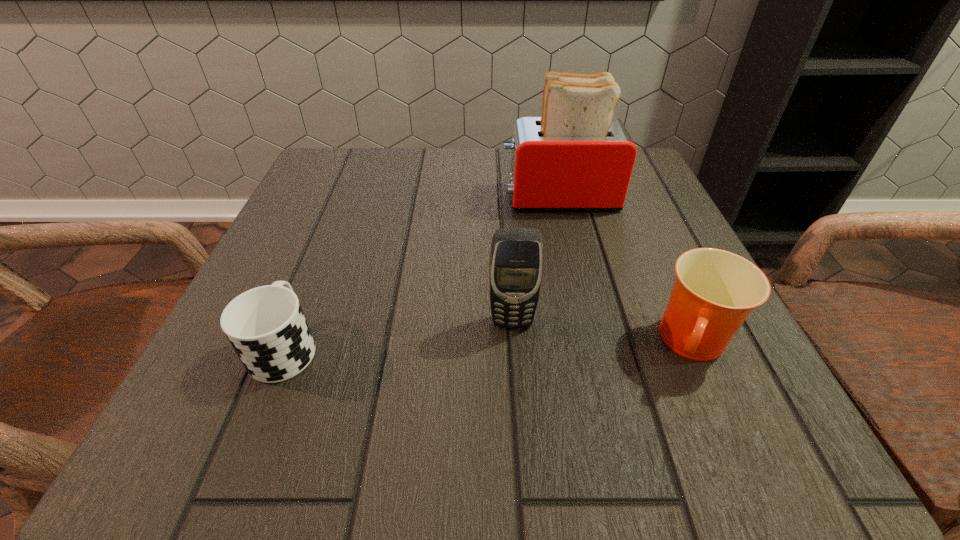
Where is `toaster`? Image resolution: width=960 pixels, height=540 pixels. toaster is located at coordinates (576, 157).

Where is `the tallest object`? the tallest object is located at coordinates (576, 157).

Where is `cellular telephone`? Image resolution: width=960 pixels, height=540 pixels. cellular telephone is located at coordinates (516, 259).

This screenshot has height=540, width=960. In order to click on the right cup in this screenshot , I will do `click(715, 290)`.

Where is `the third tallest object`? The image size is (960, 540). the third tallest object is located at coordinates (715, 290).

Locate an element on the screen. the leftmost object is located at coordinates (266, 326).

In order to click on the shorter cup in this screenshot , I will do `click(266, 326)`.

In order to click on free space located 0.370m on the front-facing side of the tallest object in this screenshot , I will do `click(323, 197)`.

This screenshot has width=960, height=540. What are the coordinates of `free space located on the front-facing side of the tallest object` in the screenshot? It's located at (327, 197).

The width and height of the screenshot is (960, 540). Identify the location of free space located 0.170m on the front-facing side of the tallest object. (420, 197).